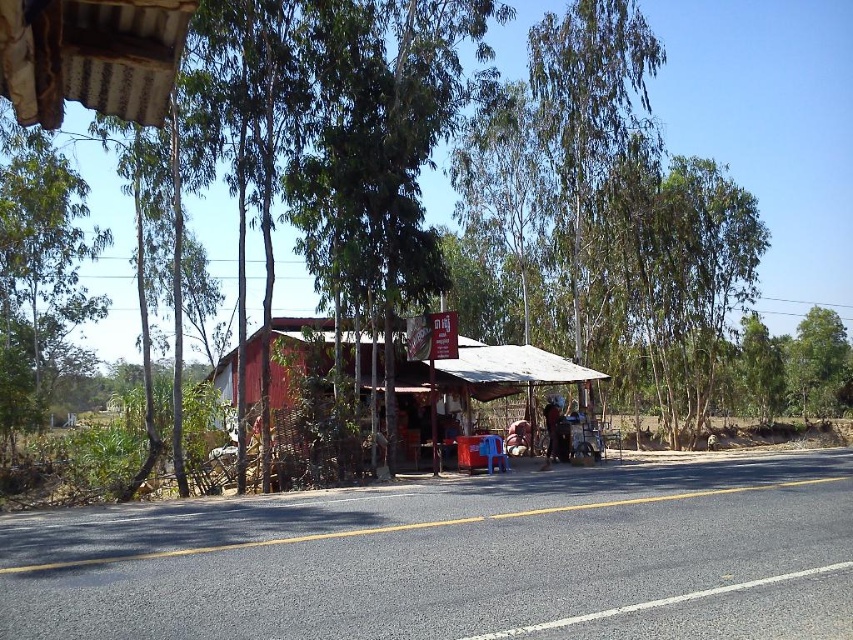
Question: Which object is the closest to the white corrugated metal roof at upper left?

Choices:
 (A) green leafy tree at left
 (B) red wooden hut at center

Answer: (B)

Question: Does green leafy tree at left have a lesser width compared to white corrugated metal roof at upper left?

Choices:
 (A) no
 (B) yes

Answer: (A)

Question: Estimate the real-world distances between objects in this image. Which object is farther from the white corrugated metal roof at upper left?

Choices:
 (A) red wooden hut at center
 (B) green leafy tree at left

Answer: (B)

Question: Estimate the real-world distances between objects in this image. Which object is closer to the green leafy tree at left?

Choices:
 (A) red wooden hut at center
 (B) white corrugated metal roof at upper left

Answer: (A)

Question: Is green leafy tree at left below white corrugated metal roof at upper left?

Choices:
 (A) yes
 (B) no

Answer: (B)

Question: Observing the image, what is the correct spatial positioning of green leafy tree at left in reference to red wooden hut at center?

Choices:
 (A) right
 (B) left

Answer: (B)